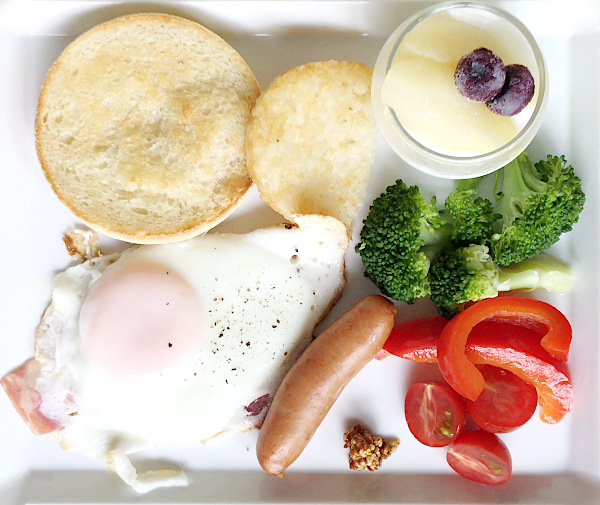
Locate an element on the screen. cup is located at coordinates (466, 176).